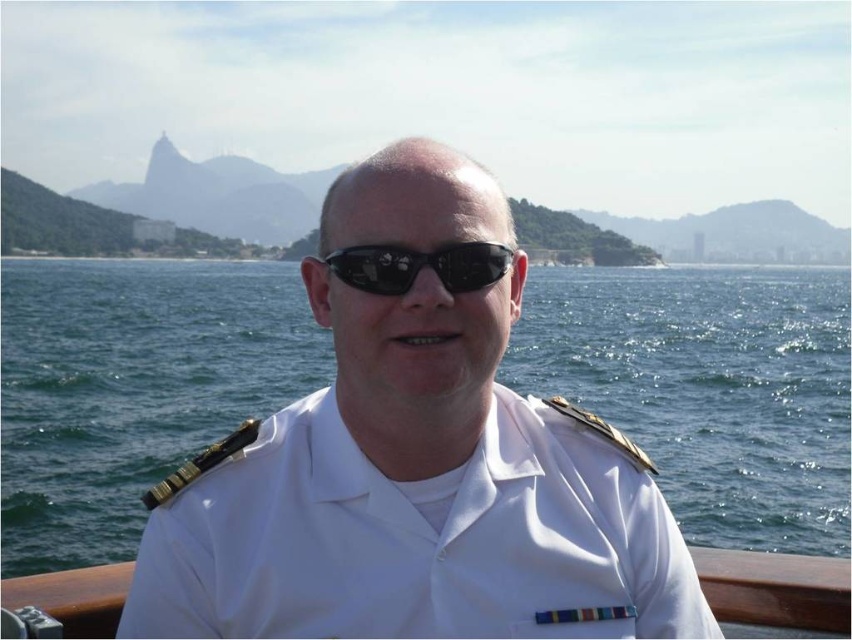
You are a photographer trying to capture a clear shot of the white uniform at center and the black reflective sunglasses at center. Which object should you focus on first if you want to ensure both are in focus, considering their sizes?

The white uniform at center is larger in size than the black reflective sunglasses at center, so you should focus on the white uniform at center first to ensure both are in focus.

You are standing on a ship deck and want to know how far the point at coordinates (464, 465) is from your current position. Can you determine the distance?

The point at coordinates (464, 465) is 62.87 feet away from your current position.